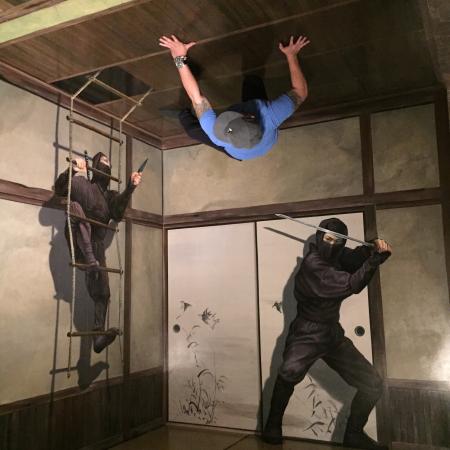
This screenshot has height=450, width=450. Find the location of `opening in ceiling`. opening in ceiling is located at coordinates (99, 84).